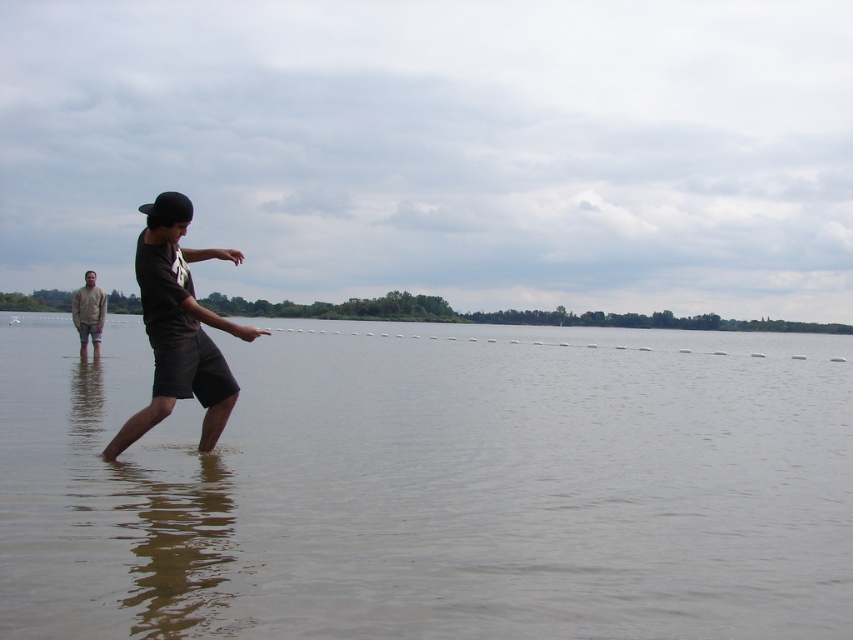
You are a photographer trying to capture the scene of the person in the water. You notice the dark gray cotton shorts at center and the light brown cotton shirt at left. Which clothing item is positioned to the right of the other?

The dark gray cotton shorts at center is positioned on the right side of light brown cotton shirt at left.

In the scene shown: You are standing on the shore and want to walk towards the clear water at center. However, there is a light brown cotton shirt at left in your path. Based on their positions, which object will you encounter first?

The clear water at center is closer to the viewer than the light brown cotton shirt at left, so you will encounter the clear water at center first before reaching the light brown cotton shirt at left.